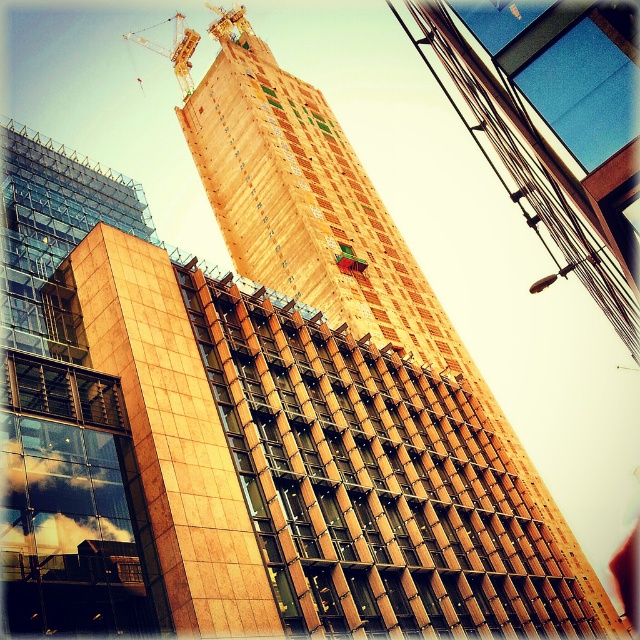
You are standing on the sidewalk looking at the brown textured building at center and the metallic yellow crane at upper left. Which one is positioned to the right side from your viewpoint?

The brown textured building at center is positioned to the right of the metallic yellow crane at upper left from your viewpoint.

You are a city planner reviewing this urban development project. You need to ensure that the metallic yellow crane at upper left can safely operate without encroaching on the brown textured building at center. Based on the spatial relationship between them, is there enough space for the crane to move freely? Please explain your reasoning.

The brown textured building at center is wider than the metallic yellow crane at upper left. Since the building is wider, there is sufficient space around the crane to allow it to move freely without encroaching on the building.